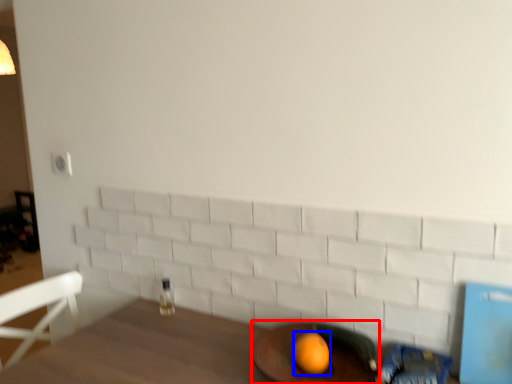
Question: Among these objects, which one is nearest to the camera, round table (highlighted by a red box) or orange (highlighted by a blue box)?

Choices:
 (A) round table
 (B) orange

Answer: (A)